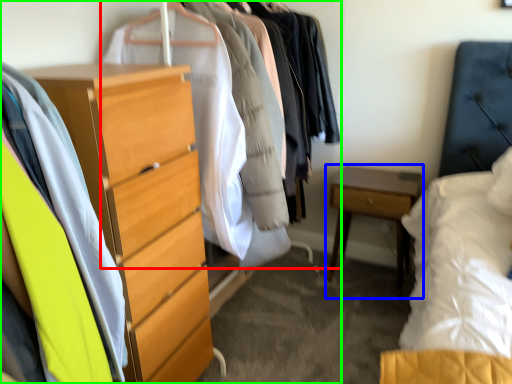
Question: Which object is the closest to the closet (highlighted by a red box)? Choose among these: nightstand (highlighted by a blue box) or closet (highlighted by a green box).

Choices:
 (A) nightstand
 (B) closet

Answer: (B)